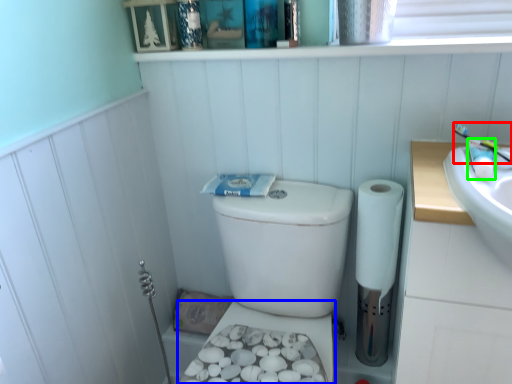
Question: Based on their relative distances, which object is nearer to toothbrush (highlighted by a red box)? Choose from bidet (highlighted by a blue box) and toiletry (highlighted by a green box).

Choices:
 (A) bidet
 (B) toiletry

Answer: (B)